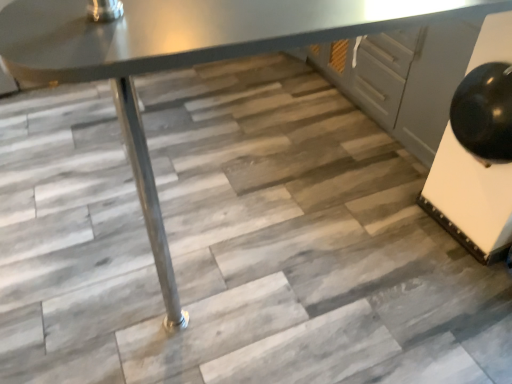
Measure the distance between point (348, 43) and camera.

Point (348, 43) is 7.68 feet away from camera.

In order to face matte gray cabinet at center, should I rotate leftwards or rightwards?

You should rotate right by 17.260 degrees.

Identify the location of matte gray cabinet at center. The width and height of the screenshot is (512, 384). (404, 78).

This screenshot has width=512, height=384. What do you see at coordinates (404, 78) in the screenshot?
I see `matte gray cabinet at center` at bounding box center [404, 78].

Locate an element on the screen. matte gray cabinet at center is located at coordinates (404, 78).